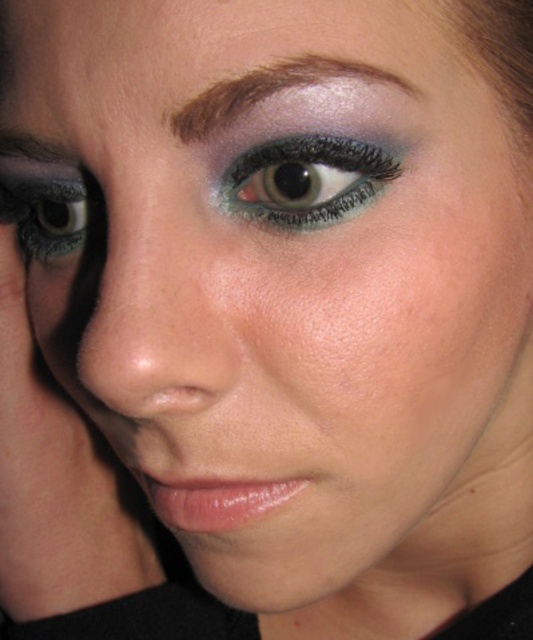
Question: Can you confirm if matte teal eye at upper left is positioned above shiny brown eyebrow at upper center?

Choices:
 (A) no
 (B) yes

Answer: (A)

Question: Which is farther from the matte black eye at left?

Choices:
 (A) shiny brown eyebrow at upper center
 (B) matte teal eye at upper left

Answer: (A)

Question: Is matte teal eye at upper left positioned behind shiny brown eyebrow at upper center?

Choices:
 (A) yes
 (B) no

Answer: (A)

Question: Which of the following is the closest to the observer?

Choices:
 (A) (46, 200)
 (B) (367, 193)
 (C) (185, 132)

Answer: (C)

Question: Which object appears closest to the camera in this image?

Choices:
 (A) matte teal eye at upper left
 (B) shiny brown eyebrow at upper center
 (C) shiny teal eye at center
 (D) matte black eye at left

Answer: (B)

Question: Can you confirm if matte teal eye at upper left is positioned above matte black eye at left?

Choices:
 (A) no
 (B) yes

Answer: (B)